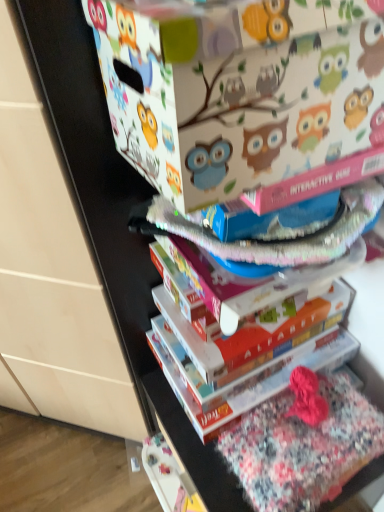
I want to click on vacant space situated above floral cotton fabric at lower right (from a real-world perspective), so click(x=298, y=434).